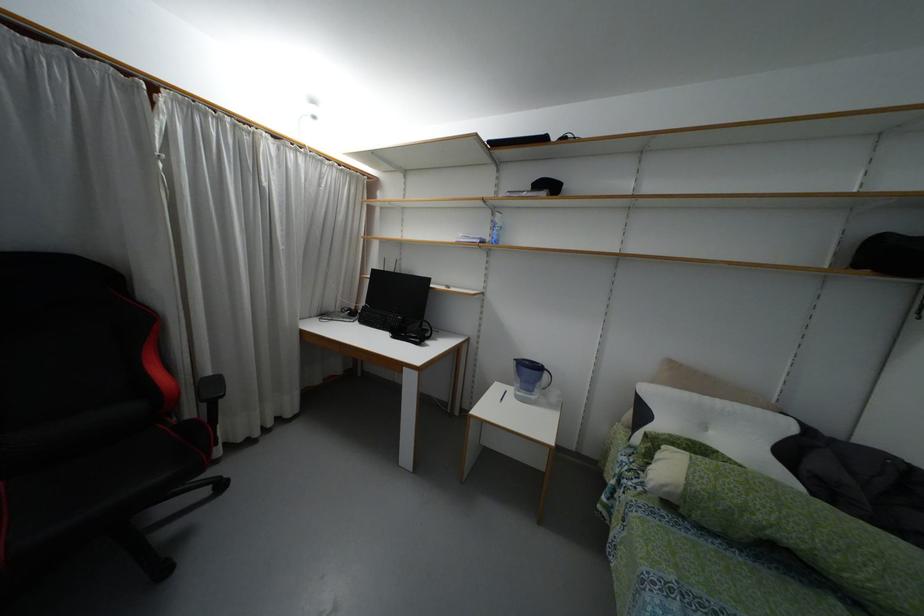
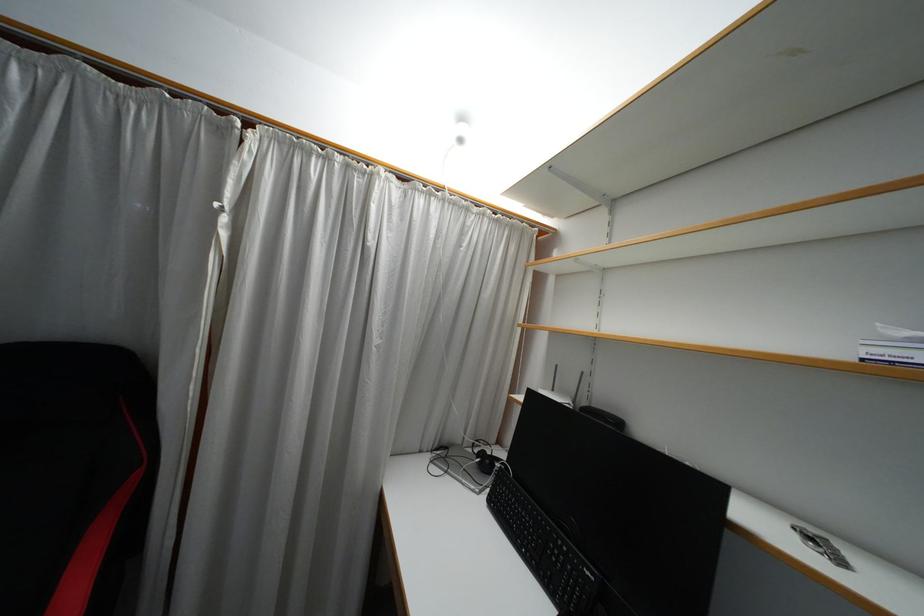
Find the pixel in the second image that matches point (313, 116) in the first image.

(459, 140)